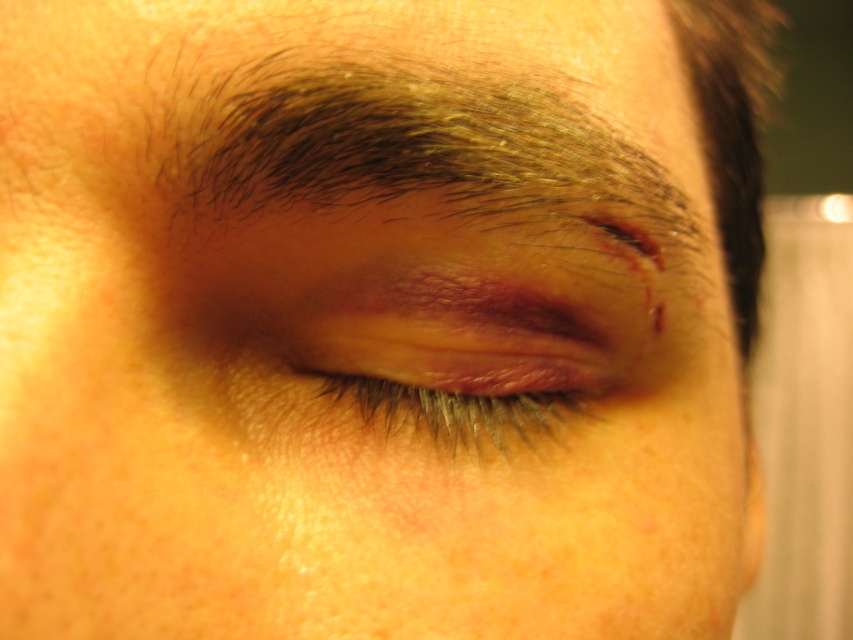
Question: Which point is closer to the camera?

Choices:
 (A) (158, 150)
 (B) (376, 364)

Answer: (A)

Question: Which point appears closest to the camera in this image?

Choices:
 (A) (320, 330)
 (B) (561, 134)

Answer: (B)

Question: Does dark brown hair at upper center appear over swollen skin at center?

Choices:
 (A) yes
 (B) no

Answer: (A)

Question: Which of the following is the closest to the observer?

Choices:
 (A) (363, 348)
 (B) (672, 244)

Answer: (A)

Question: Is dark brown hair at upper center to the right of swollen skin at center from the viewer's perspective?

Choices:
 (A) no
 (B) yes

Answer: (B)

Question: Can you confirm if dark brown hair at upper center is thinner than swollen skin at center?

Choices:
 (A) yes
 (B) no

Answer: (B)